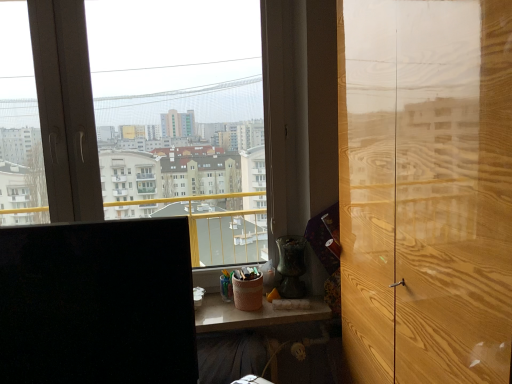
Find the location of `black matte computer monitor at left`. black matte computer monitor at left is located at coordinates (97, 303).

Identify the location of light brown wood door at right. (426, 189).

Which object is further away from the camera taking this photo, transparent glass window at center or wooden table at lower center?

transparent glass window at center is behind.

From the picture: Which point is more forward, (96,178) or (303,381)?

The point (96,178) is closer to the camera.

Find the location of a particular element. The width and height of the screenshot is (512, 384). window behind the wooden table at lower center is located at coordinates (181, 119).

Is transparent glass window at center with wooden table at lower center?

transparent glass window at center and wooden table at lower center are not in contact.

Is wooden table at lower center further to the viewer compared to black matte computer monitor at left?

Yes, the depth of wooden table at lower center is greater than that of black matte computer monitor at left.

Is wooden table at lower center facing towards black matte computer monitor at left?

No.

Is wooden table at lower center taller or shorter than black matte computer monitor at left?

Considering their sizes, wooden table at lower center has less height than black matte computer monitor at left.

Looking at this image, is black matte computer monitor at left wider than light brown wood door at right?

Indeed, black matte computer monitor at left has a greater width compared to light brown wood door at right.

From the image's perspective, which object appears higher, black matte computer monitor at left or light brown wood door at right?

light brown wood door at right.

How different are the orientations of black matte computer monitor at left and light brown wood door at right in degrees?

The facing directions of black matte computer monitor at left and light brown wood door at right are 84.8 degrees apart.

Which is behind, light brown wood door at right or wooden table at lower center?

Positioned behind is wooden table at lower center.

Looking at this image, between light brown wood door at right and wooden table at lower center, which one has larger size?

light brown wood door at right is bigger.

Is point (428, 299) more distant than point (263, 339)?

No, it is in front of (263, 339).

Is light brown wood door at right positioned beyond the bounds of wooden table at lower center?

Yes, light brown wood door at right is not within wooden table at lower center.

Is light brown wood door at right in front of or behind black matte computer monitor at left in the image?

light brown wood door at right is in front of black matte computer monitor at left.

Is light brown wood door at right not within black matte computer monitor at left?

light brown wood door at right is positioned outside black matte computer monitor at left.

Which of these two, light brown wood door at right or black matte computer monitor at left, is bigger?

light brown wood door at right is bigger.

Which object is further away from the camera, transparent glass window at center or black matte computer monitor at left?

transparent glass window at center is further from the camera.

Measure the distance from transparent glass window at center to black matte computer monitor at left.

The distance of transparent glass window at center from black matte computer monitor at left is 37.96 inches.

Considering the sizes of objects transparent glass window at center and black matte computer monitor at left in the image provided, who is shorter, transparent glass window at center or black matte computer monitor at left?

black matte computer monitor at left is shorter.

Which of these two, transparent glass window at center or black matte computer monitor at left, is smaller?

transparent glass window at center is smaller.

Considering the relative sizes of black matte computer monitor at left and transparent glass window at center in the image provided, is black matte computer monitor at left shorter than transparent glass window at center?

Correct, black matte computer monitor at left is not as tall as transparent glass window at center.

Considering the relative sizes of black matte computer monitor at left and transparent glass window at center in the image provided, is black matte computer monitor at left bigger than transparent glass window at center?

Indeed, black matte computer monitor at left has a larger size compared to transparent glass window at center.

How different are the orientations of black matte computer monitor at left and transparent glass window at center in degrees?

The angle between the facing direction of black matte computer monitor at left and the facing direction of transparent glass window at center is 5.74 degrees.

From the image's perspective, would you say black matte computer monitor at left is positioned over transparent glass window at center?

No, from the image's perspective, black matte computer monitor at left is not on top of transparent glass window at center.

The width and height of the screenshot is (512, 384). I want to click on table that appears below the transparent glass window at center (from a real-world perspective), so click(x=248, y=336).

Image resolution: width=512 pixels, height=384 pixels. I want to click on table behind the black matte computer monitor at left, so click(x=248, y=336).

Looking at the image, which one is located further to transparent glass window at center, wooden table at lower center or black matte computer monitor at left?

The object further to transparent glass window at center is black matte computer monitor at left.

Looking at the image, which one is located further to transparent glass window at center, black matte computer monitor at left or wooden table at lower center?

black matte computer monitor at left is further to transparent glass window at center.

Based on their spatial positions, is black matte computer monitor at left or wooden table at lower center further from light brown wood door at right?

Among the two, wooden table at lower center is located further to light brown wood door at right.

Based on their spatial positions, is transparent glass window at center or wooden table at lower center closer to light brown wood door at right?

wooden table at lower center is positioned closer to the anchor light brown wood door at right.

Estimate the real-world distances between objects in this image. Which object is closer to wooden table at lower center, transparent glass window at center or light brown wood door at right?

Among the two, transparent glass window at center is located nearer to wooden table at lower center.

Estimate the real-world distances between objects in this image. Which object is further from black matte computer monitor at left, wooden table at lower center or transparent glass window at center?

transparent glass window at center lies further to black matte computer monitor at left than the other object.

Estimate the real-world distances between objects in this image. Which object is closer to transparent glass window at center, light brown wood door at right or wooden table at lower center?

wooden table at lower center.

Which object lies nearer to the anchor point transparent glass window at center, black matte computer monitor at left or light brown wood door at right?

light brown wood door at right is closer to transparent glass window at center.

Image resolution: width=512 pixels, height=384 pixels. In order to click on table between black matte computer monitor at left and light brown wood door at right in this screenshot , I will do `click(248, 336)`.

Where is `computer monitor between transparent glass window at center and wooden table at lower center vertically`? This screenshot has height=384, width=512. computer monitor between transparent glass window at center and wooden table at lower center vertically is located at coordinates (97, 303).

You are a GUI agent. You are given a task and a screenshot of the screen. Output one action in this format:
    pyautogui.click(x=<x>, y=<y>)
    Task: Click on the window between black matte computer monitor at left and light brown wood door at right
    The height and width of the screenshot is (384, 512).
    Given the screenshot: What is the action you would take?
    pyautogui.click(x=181, y=119)

Locate an element on the screen. Image resolution: width=512 pixels, height=384 pixels. table between light brown wood door at right and transparent glass window at center along the z-axis is located at coordinates (248, 336).